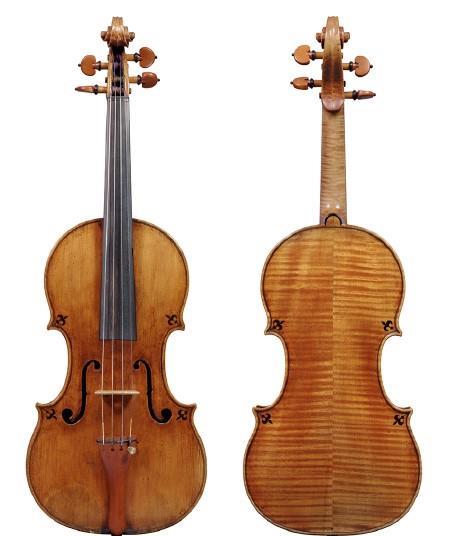
Find the location of a particular element. The width and height of the screenshot is (453, 536). peg is located at coordinates (363, 93), (88, 89).